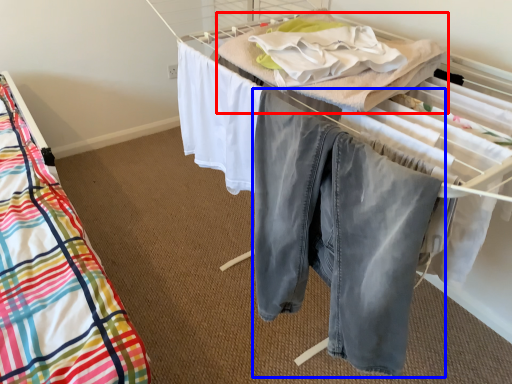
Question: Which point is further to the camera, blanket (highlighted by a red box) or trousers (highlighted by a blue box)?

Choices:
 (A) blanket
 (B) trousers

Answer: (A)